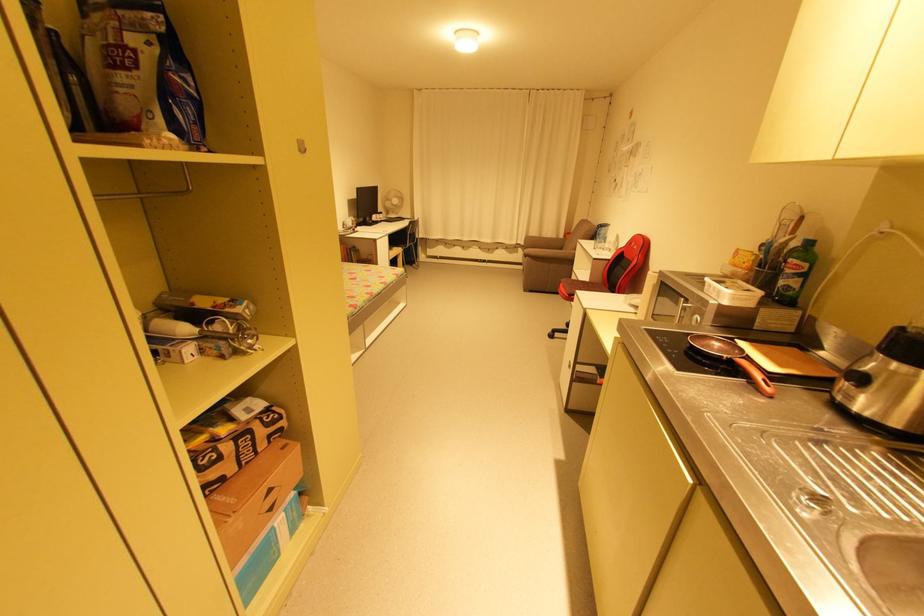
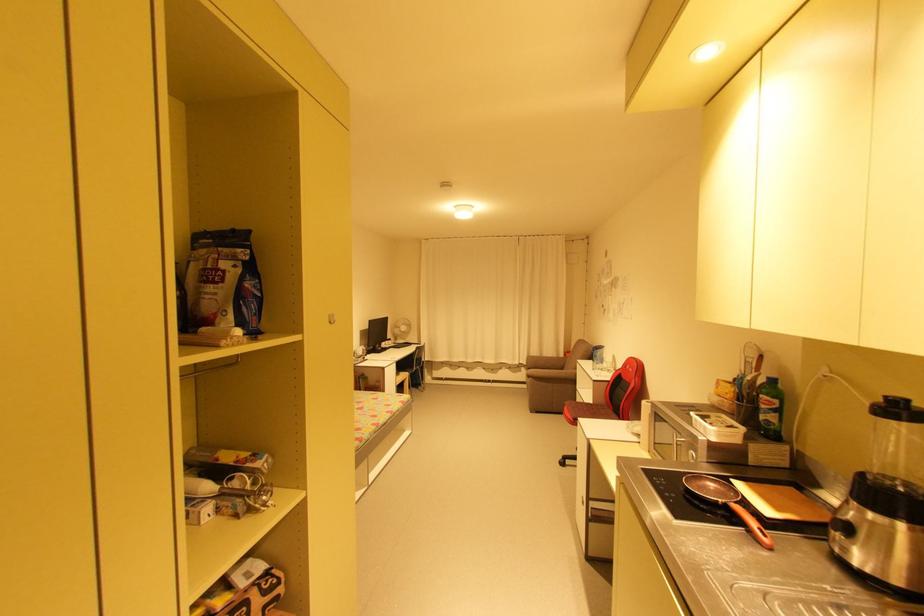
Question: The first image is from the beginning of the video and the second image is from the end. How did the camera likely rotate when shooting the video?

Choices:
 (A) Left
 (B) Right
 (C) Up
 (D) Down

Answer: (C)